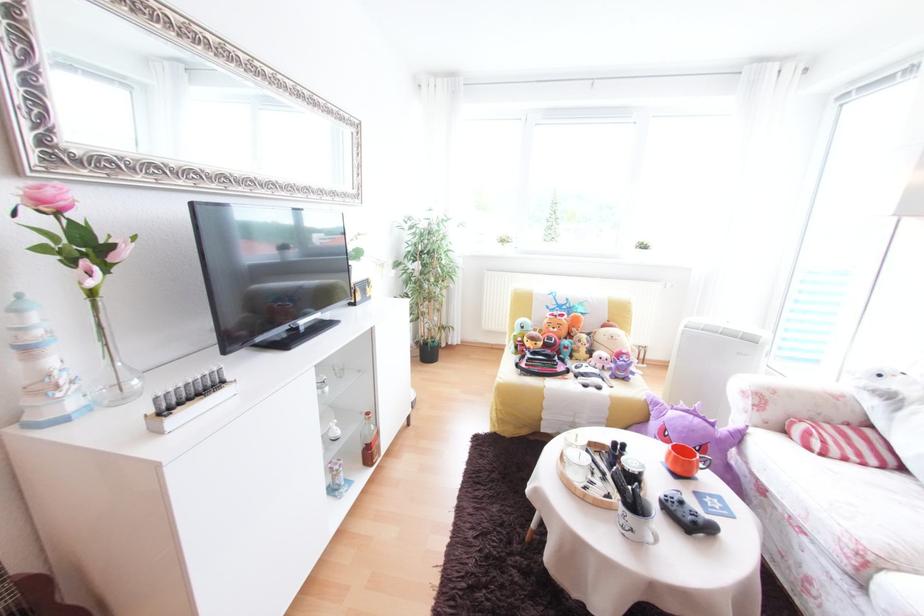
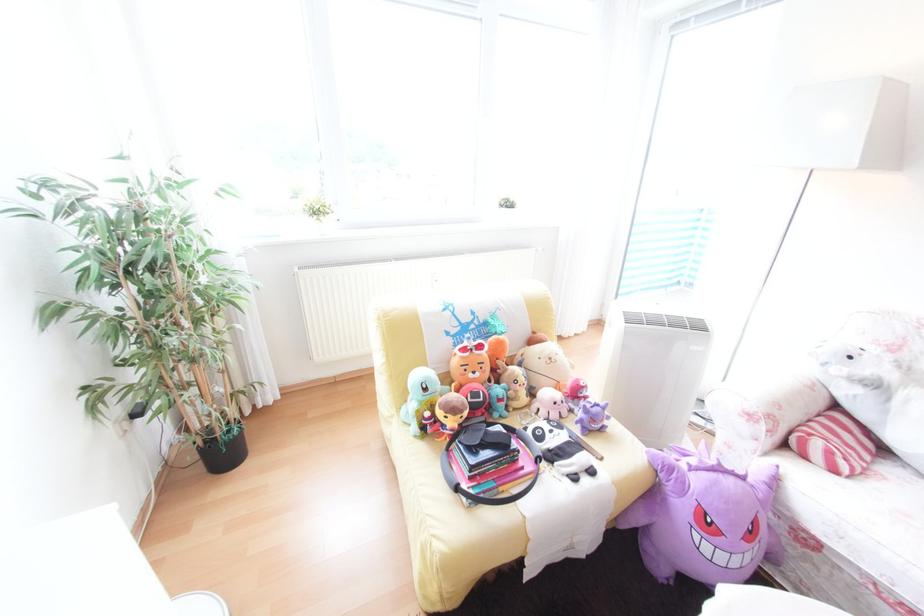
In the second image, find the point that corresponds to (x=565, y=365) in the first image.

(526, 455)